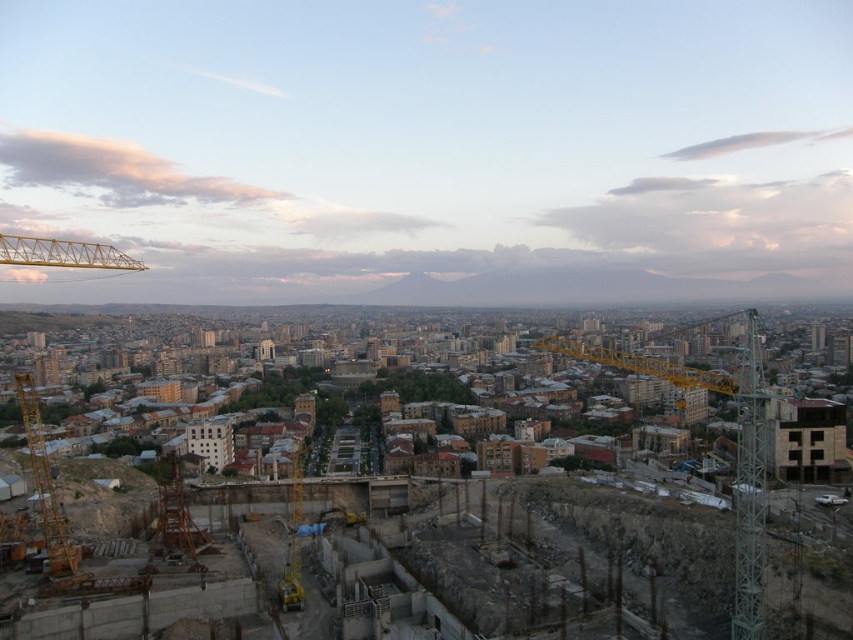
Which is behind, point (751, 483) or point (51, 556)?

Positioned behind is point (51, 556).

You are a GUI agent. You are given a task and a screenshot of the screen. Output one action in this format:
    pyautogui.click(x=<x>, y=<y>)
    Task: Click on the yellow metallic crane at right
    The height and width of the screenshot is (640, 853).
    Given the screenshot: What is the action you would take?
    pyautogui.click(x=735, y=452)

Does concrete construction site at center have a smaller size compared to yellow metallic crane at lower left?

Correct, concrete construction site at center occupies less space than yellow metallic crane at lower left.

Find the location of a particular element. The width and height of the screenshot is (853, 640). concrete construction site at center is located at coordinates coord(764,548).

The height and width of the screenshot is (640, 853). What do you see at coordinates (764, 548) in the screenshot?
I see `concrete construction site at center` at bounding box center [764, 548].

Does concrete construction site at center appear over yellow metallic crane at right?

Actually, concrete construction site at center is below yellow metallic crane at right.

Which is behind, point (706, 541) or point (624, 355)?

The point (624, 355) is more distant.

Find the location of a particular element. This screenshot has height=640, width=853. concrete construction site at center is located at coordinates (764, 548).